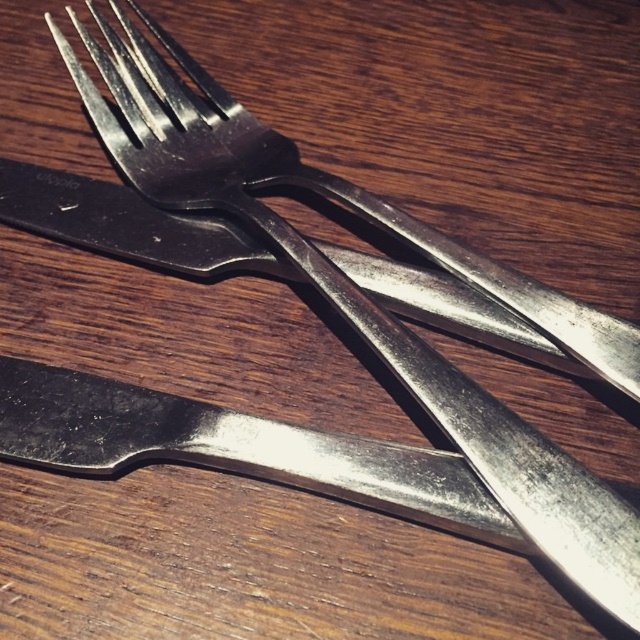
Does polished silver knife at lower left appear on the right side of polished metal fork at center?

No, polished silver knife at lower left is not to the right of polished metal fork at center.

Does polished silver knife at lower left appear under polished metal fork at center?

Yes, polished silver knife at lower left is below polished metal fork at center.

The height and width of the screenshot is (640, 640). What do you see at coordinates (234, 449) in the screenshot?
I see `polished silver knife at lower left` at bounding box center [234, 449].

This screenshot has height=640, width=640. In order to click on polished silver knife at lower left in this screenshot , I will do `click(234, 449)`.